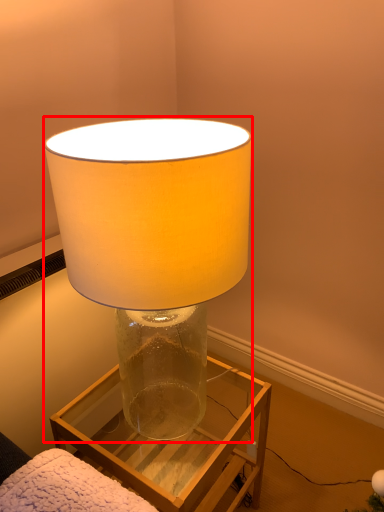
Question: From the image's perspective, what is the correct spatial positioning of lamp (annotated by the red box) in reference to furniture?

Choices:
 (A) below
 (B) above

Answer: (B)